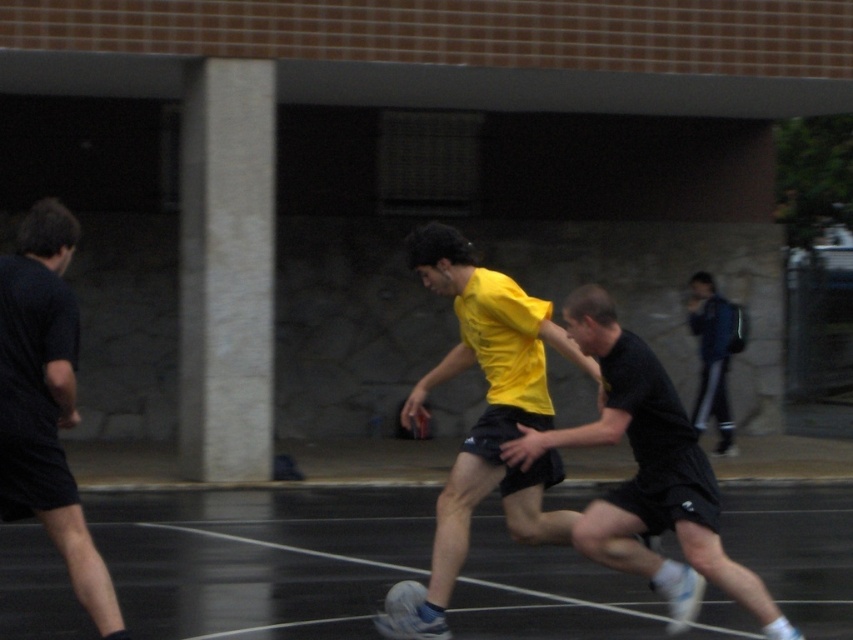
Question: Which point is farther from the camera taking this photo?

Choices:
 (A) (759, 605)
 (B) (468, 516)

Answer: (B)

Question: Can you confirm if yellow matte shirt at center is positioned below black textured shorts at center?

Choices:
 (A) yes
 (B) no

Answer: (B)

Question: Estimate the real-world distances between objects in this image. Which object is farther from the yellow matte shirt at center?

Choices:
 (A) blue denim jacket at upper right
 (B) black textured shorts at center

Answer: (A)

Question: Does yellow matte shirt at center have a larger size compared to black matte shorts at left?

Choices:
 (A) yes
 (B) no

Answer: (A)

Question: Which point is closer to the camera taking this photo?

Choices:
 (A) (57, 374)
 (B) (701, 355)
 (C) (726, 556)

Answer: (A)

Question: Can you confirm if yellow matte shirt at center is smaller than black matte shorts at left?

Choices:
 (A) no
 (B) yes

Answer: (A)